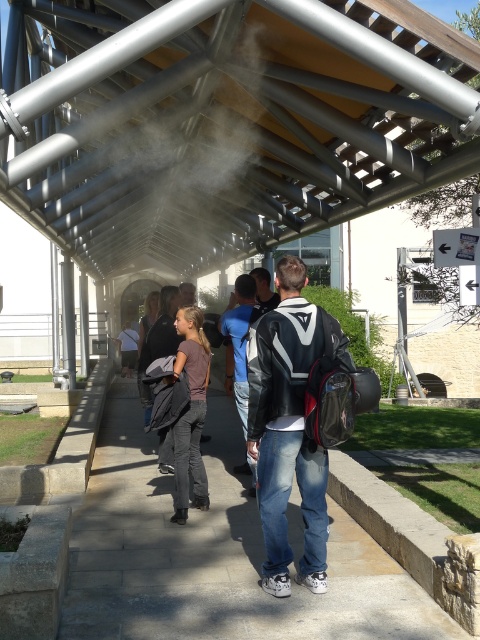
You are standing in the entrance area and want to take a photo of the matte black jacket at center without the white fog at center appearing in the foreground. Is this possible based on their positions?

The white fog at center is further to the viewer than matte black jacket at center, so the matte black jacket is between you and the white fog. Therefore, you cannot avoid the matte black jacket at center being in front of the white fog at center, making it impossible to take a photo of the matte black jacket without the white fog in the foreground.

You are a tourist navigating through the modern architectural structure. You see the white fog at center and the paved stone sidewalk at center. Which one is above the other?

The white fog at center is positioned over the paved stone sidewalk at center, so the white fog is above the sidewalk.